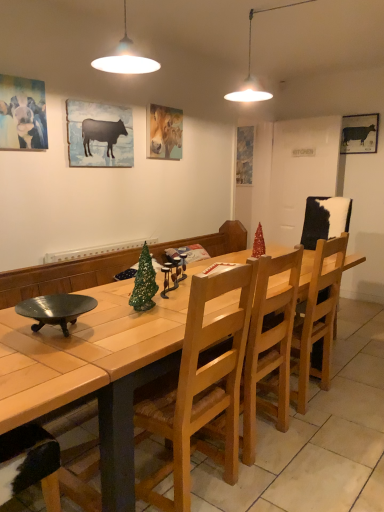
This screenshot has height=512, width=384. I want to click on spots to the right of cowhide leather chair at right, so coord(356,341).